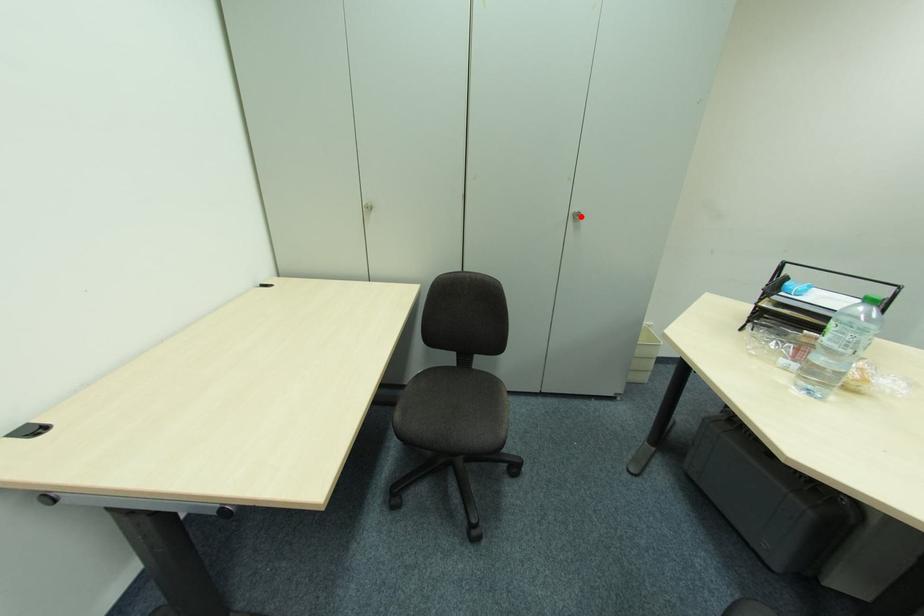
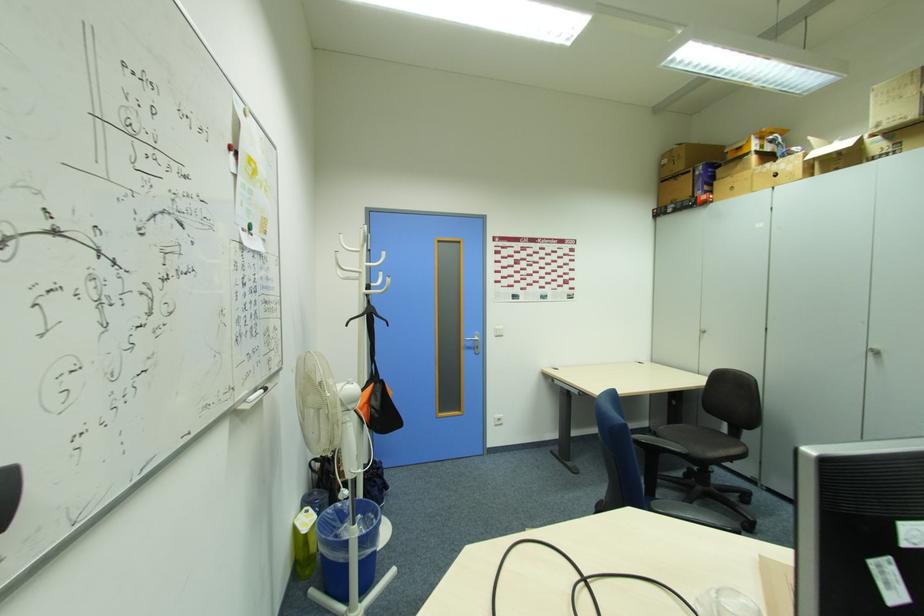
The point at the highlighted location is marked in the first image. Where is the corresponding point in the second image?

(880, 354)